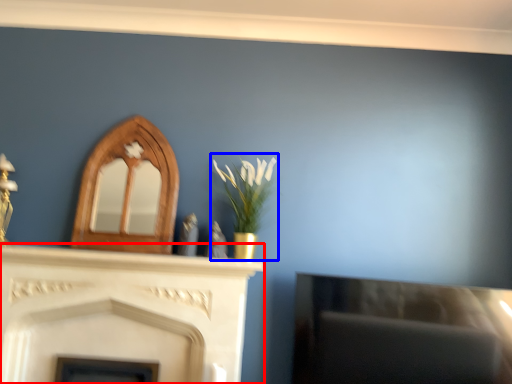
Question: Which object is further to the camera taking this photo, fireplace (highlighted by a red box) or floral arrangement (highlighted by a blue box)?

Choices:
 (A) fireplace
 (B) floral arrangement

Answer: (B)